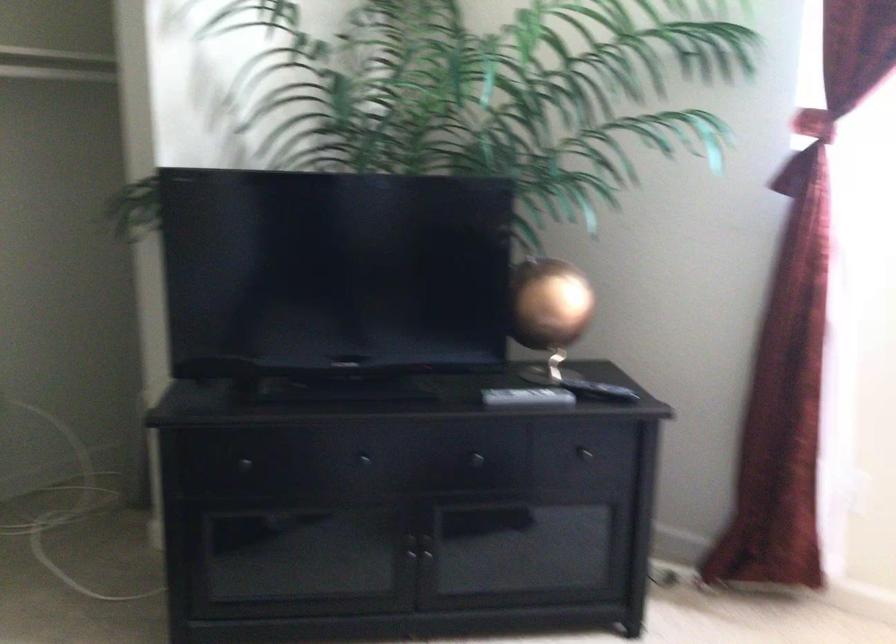
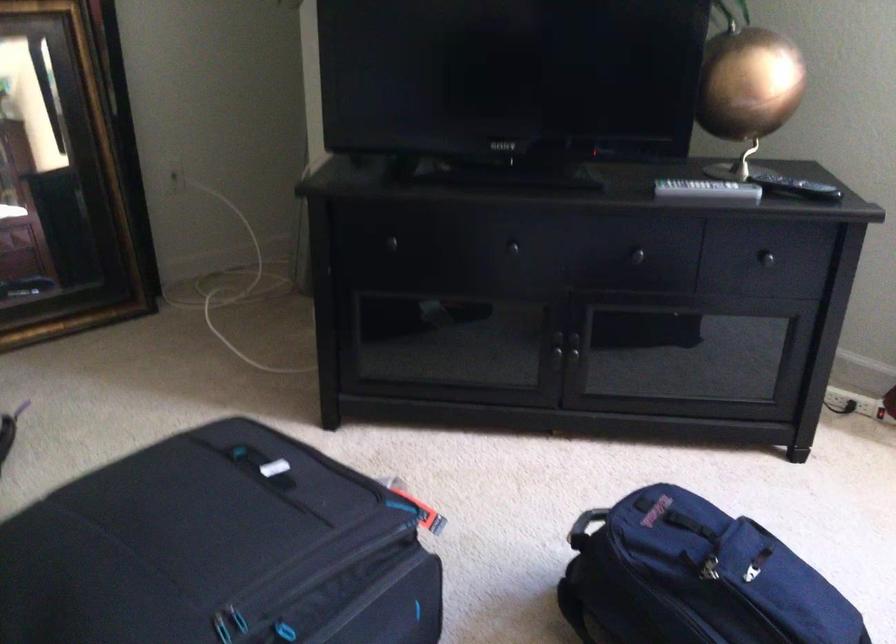
Locate, in the second image, the point that corresponds to [471,460] in the first image.

(631, 257)